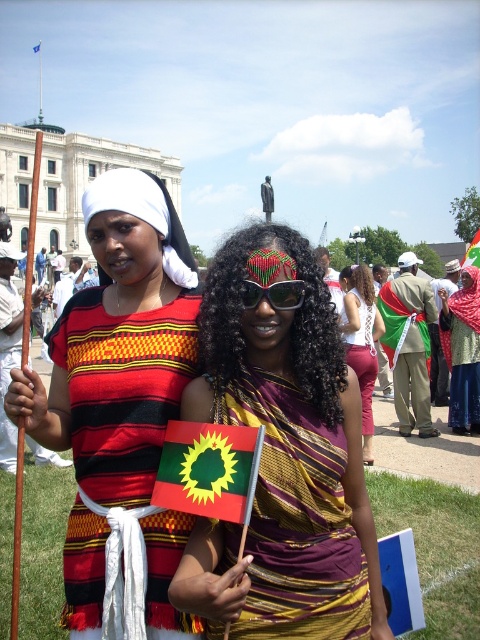
Question: Which of the following is the farthest from the observer?

Choices:
 (A) (465, 259)
 (B) (36, 44)
 (C) (340, 317)
 (D) (295, 467)

Answer: (B)

Question: Which point is closer to the camera?

Choices:
 (A) (407, 410)
 (B) (477, 257)
 (C) (197, 305)

Answer: (C)

Question: Which point is farther from the camera taking this photo?

Choices:
 (A) (248, 472)
 (B) (74, 611)
 (C) (344, 307)

Answer: (C)

Question: In this image, where is matte fabric dress at center located relative to green fabric flag at center?

Choices:
 (A) right
 (B) left

Answer: (B)

Question: Does matte black dress at center appear on the left side of matte red skirt at center?

Choices:
 (A) yes
 (B) no

Answer: (A)

Question: Does matte red pants at center have a larger size compared to blue fabric flag at center?

Choices:
 (A) yes
 (B) no

Answer: (A)